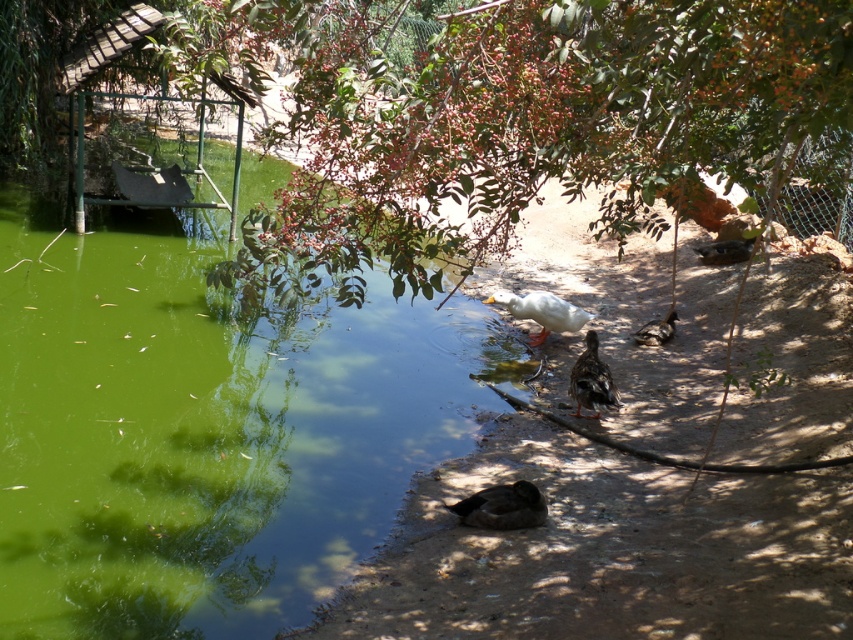
Question: Which point appears closest to the camera in this image?

Choices:
 (A) (596, 371)
 (B) (315, 413)
 (C) (486, 499)
 (D) (656, 332)

Answer: (C)

Question: Does white matte duck at center appear over brown speckled duck at center?

Choices:
 (A) yes
 (B) no

Answer: (A)

Question: Which of the following is the closest to the observer?

Choices:
 (A) (543, 298)
 (B) (479, 513)
 (C) (654, 337)

Answer: (B)

Question: Is brown fuzzy duck at lower center bigger than brown matte duck at center-right?

Choices:
 (A) no
 (B) yes

Answer: (A)

Question: Which point is closer to the camera?

Choices:
 (A) brown matte duck at center-right
 (B) green algae water at lower left

Answer: (B)

Question: Can you confirm if brown fuzzy duck at lower center is positioned above white matte duck at center?

Choices:
 (A) no
 (B) yes

Answer: (A)